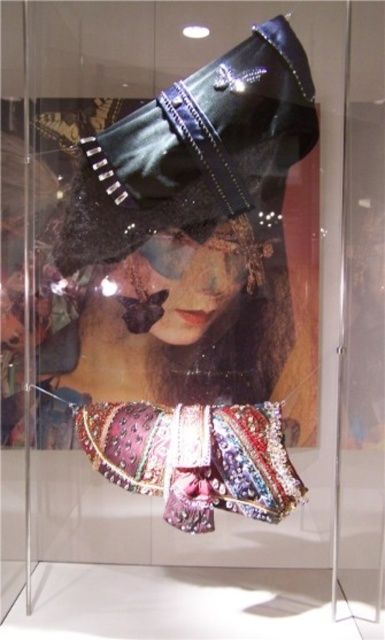
Question: Does leather-like black hat at upper center appear on the right side of shiny sequined fabric at center?

Choices:
 (A) no
 (B) yes

Answer: (B)

Question: Which object is farther from the camera taking this photo?

Choices:
 (A) leather-like black hat at upper center
 (B) shiny sequined fabric at center

Answer: (A)

Question: Is leather-like black hat at upper center smaller than shiny sequined fabric at center?

Choices:
 (A) no
 (B) yes

Answer: (A)

Question: Can you confirm if leather-like black hat at upper center is positioned below shiny sequined fabric at center?

Choices:
 (A) yes
 (B) no

Answer: (B)